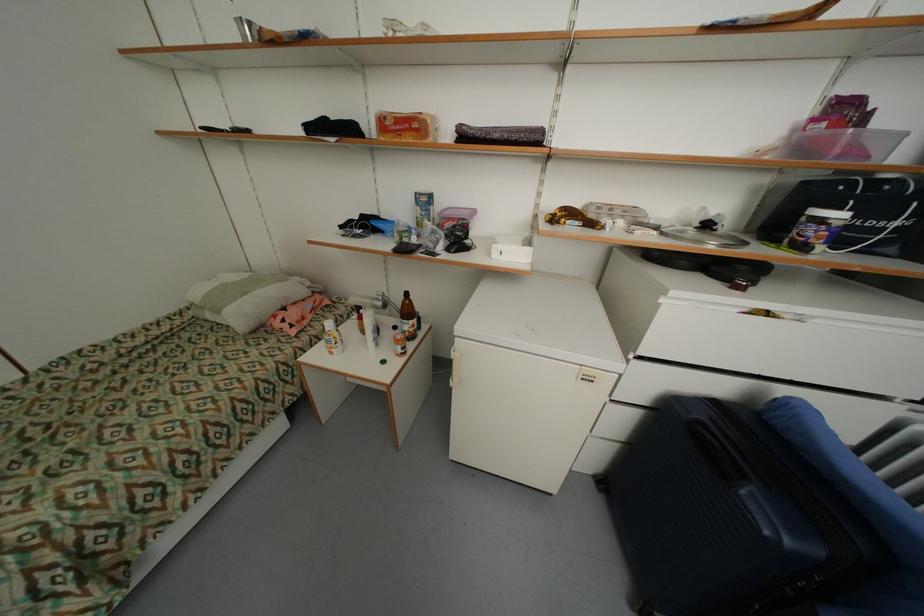
Where would you pour the brown glass bottle? Please return your answer as a coordinate pair (x, y).

(407, 315)